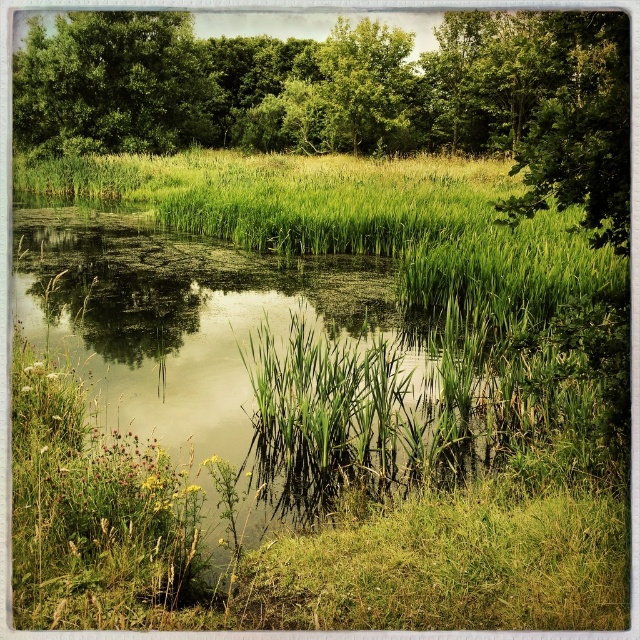
Is point (513, 221) positioned after point (176, 72)?

No, it is not.

Image resolution: width=640 pixels, height=640 pixels. What are the coordinates of `green leafy tree at center` in the screenshot? It's located at (349, 97).

Locate an element on the screen. This screenshot has width=640, height=640. green leafy tree at center is located at coordinates [x=349, y=97].

I want to click on green leafy tree at center, so click(349, 97).